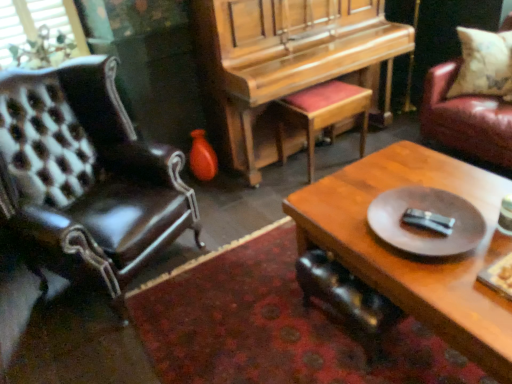
Question: Is white mesh window screen at upper left placed right next to wooden coffee table at center?

Choices:
 (A) no
 (B) yes

Answer: (A)

Question: Considering the relative sizes of white mesh window screen at upper left and wooden coffee table at center in the image provided, is white mesh window screen at upper left smaller than wooden coffee table at center?

Choices:
 (A) yes
 (B) no

Answer: (A)

Question: From the image's perspective, is white mesh window screen at upper left located above wooden coffee table at center?

Choices:
 (A) yes
 (B) no

Answer: (A)

Question: From the image's perspective, is white mesh window screen at upper left beneath wooden coffee table at center?

Choices:
 (A) no
 (B) yes

Answer: (A)

Question: Does white mesh window screen at upper left have a lesser width compared to wooden coffee table at center?

Choices:
 (A) yes
 (B) no

Answer: (A)

Question: Is floral-patterned fabric pillow at upper right in front of or behind leather chair at left, which is counted as the 1th chair, starting from the left, in the image?

Choices:
 (A) behind
 (B) front

Answer: (A)

Question: Is point (490, 33) positioned closer to the camera than point (62, 203)?

Choices:
 (A) farther
 (B) closer

Answer: (A)

Question: In terms of height, does floral-patterned fabric pillow at upper right look taller or shorter compared to leather chair at left, which is counted as the 1th chair, starting from the left?

Choices:
 (A) short
 (B) tall

Answer: (A)

Question: From a real-world perspective, is floral-patterned fabric pillow at upper right physically located above or below leather chair at left, the second chair viewed from the right?

Choices:
 (A) above
 (B) below

Answer: (A)

Question: In terms of height, does wooden coffee table at center look taller or shorter compared to shiny black leather chair at lower center, marked as the 1th chair in a right-to-left arrangement?

Choices:
 (A) tall
 (B) short

Answer: (A)

Question: Would you say wooden coffee table at center is inside or outside shiny black leather chair at lower center, marked as the 1th chair in a right-to-left arrangement?

Choices:
 (A) outside
 (B) inside

Answer: (A)

Question: From a real-world perspective, is wooden coffee table at center positioned above or below shiny black leather chair at lower center, the second chair positioned from the left?

Choices:
 (A) below
 (B) above

Answer: (B)

Question: Is wooden coffee table at center wider or thinner than shiny black leather chair at lower center, the second chair positioned from the left?

Choices:
 (A) wide
 (B) thin

Answer: (A)

Question: Considering the positions of point (215, 160) and point (309, 24), is point (215, 160) closer or farther from the camera than point (309, 24)?

Choices:
 (A) closer
 (B) farther

Answer: (B)

Question: Considering the positions of shiny orange vase at center and wooden piano at center in the image, is shiny orange vase at center wider or thinner than wooden piano at center?

Choices:
 (A) wide
 (B) thin

Answer: (B)